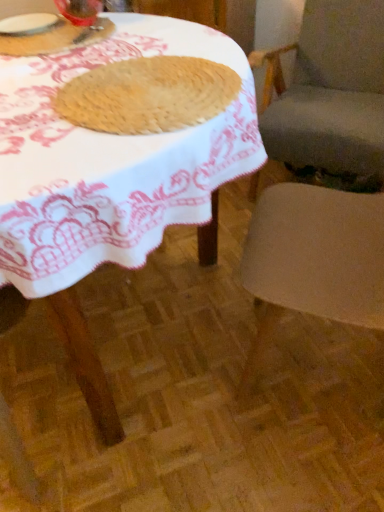
Locate an element on the screen. vacant area that is situated to the right of white glossy plate at upper left, marked as the second tableware in a right-to-left arrangement is located at coordinates click(97, 30).